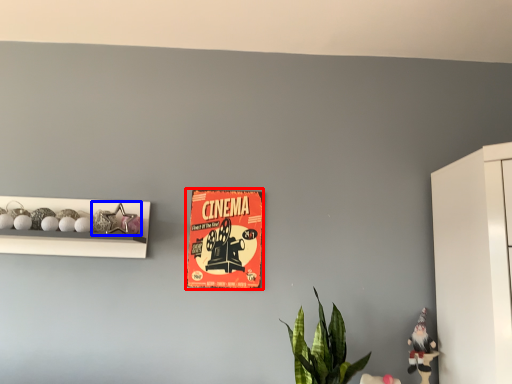
Question: Which object appears closest to the camera in this image, postcard (highlighted by a red box) or toy (highlighted by a blue box)?

Choices:
 (A) postcard
 (B) toy

Answer: (B)